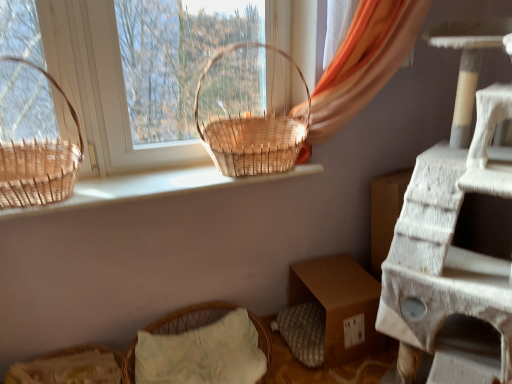
Question: From a real-world perspective, is woven straw basket at lower left below natural wood basket at upper center?

Choices:
 (A) yes
 (B) no

Answer: (A)

Question: Can you confirm if woven straw basket at lower left is wider than natural wood basket at upper center?

Choices:
 (A) no
 (B) yes

Answer: (B)

Question: Can you confirm if woven straw basket at lower left is smaller than natural wood basket at upper center?

Choices:
 (A) yes
 (B) no

Answer: (B)

Question: Can you confirm if woven straw basket at lower left is thinner than natural wood basket at upper center?

Choices:
 (A) no
 (B) yes

Answer: (A)

Question: Is woven straw basket at lower left behind natural wood basket at upper center?

Choices:
 (A) no
 (B) yes

Answer: (B)

Question: Does woven straw basket at lower left have a larger size compared to natural wood basket at upper center?

Choices:
 (A) no
 (B) yes

Answer: (B)

Question: Could you tell me if woven natural basket at center, which appears as the 1th picnic basket when viewed from the right, is turned towards brown woven basket at left, which is counted as the first picnic basket, starting from the left?

Choices:
 (A) yes
 (B) no

Answer: (B)

Question: Considering the relative sizes of woven natural basket at center, which appears as the 1th picnic basket when viewed from the right, and brown woven basket at left, the second picnic basket viewed from the right, in the image provided, is woven natural basket at center, which appears as the 1th picnic basket when viewed from the right, wider than brown woven basket at left, the second picnic basket viewed from the right,?

Choices:
 (A) no
 (B) yes

Answer: (A)

Question: Is woven natural basket at center, which appears as the 1th picnic basket when viewed from the right, outside of brown woven basket at left, which is counted as the first picnic basket, starting from the left?

Choices:
 (A) yes
 (B) no

Answer: (A)

Question: From the image's perspective, is woven natural basket at center, which appears as the 1th picnic basket when viewed from the right, beneath brown woven basket at left, the second picnic basket viewed from the right?

Choices:
 (A) yes
 (B) no

Answer: (B)

Question: Is woven natural basket at center, which appears as the 1th picnic basket when viewed from the right, smaller than brown woven basket at left, which is counted as the first picnic basket, starting from the left?

Choices:
 (A) yes
 (B) no

Answer: (B)

Question: Can brown woven basket at left, which is counted as the first picnic basket, starting from the left, be found inside woven natural basket at center, which appears as the 1th picnic basket when viewed from the right?

Choices:
 (A) yes
 (B) no

Answer: (B)

Question: From the image's perspective, is woven natural basket at center, which appears as the 1th picnic basket when viewed from the right, over natural wood basket at upper center?

Choices:
 (A) yes
 (B) no

Answer: (A)